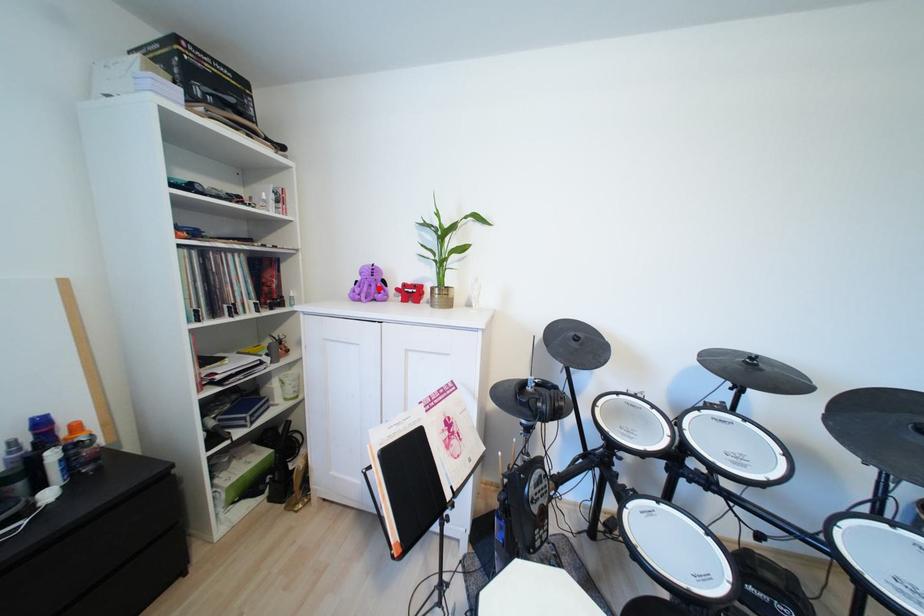
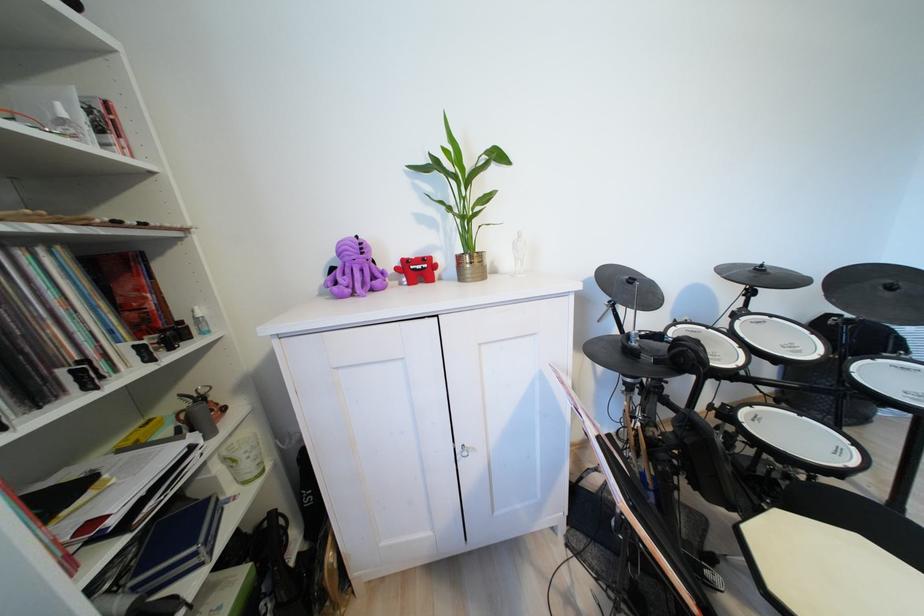
Locate, in the second image, the point that corresponds to the highlighted location in the first image.

(360, 274)